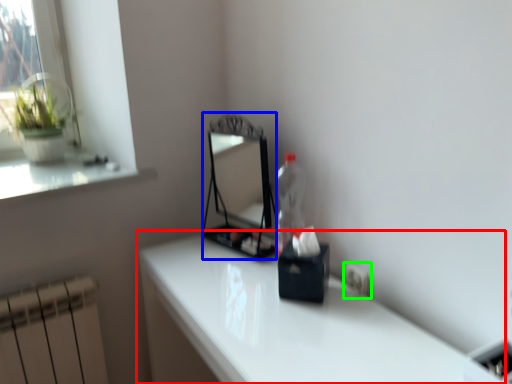
Question: Which is farther away from table (highlighted by a red box)? mirror (highlighted by a blue box) or electric outlet (highlighted by a green box)?

Choices:
 (A) mirror
 (B) electric outlet

Answer: (A)